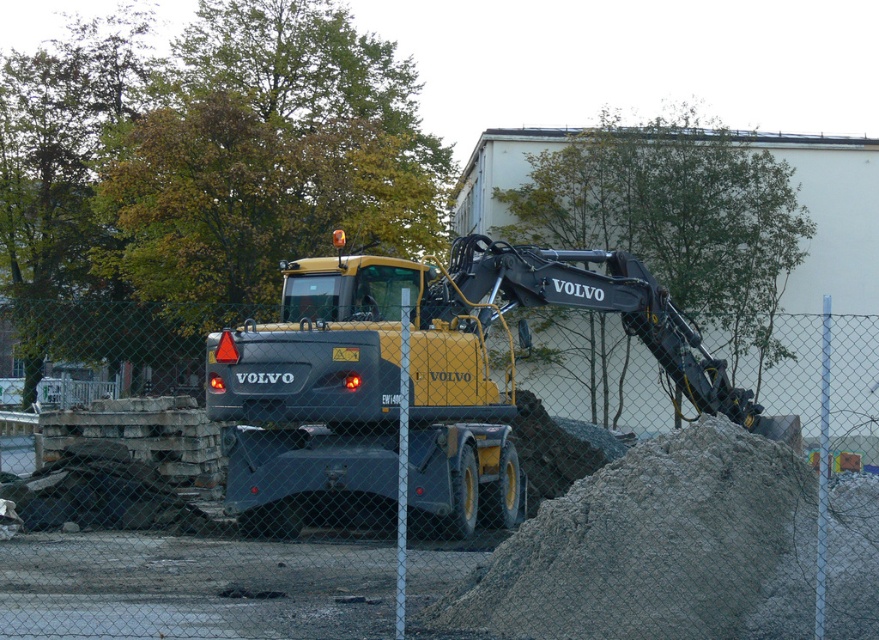
Who is more forward, (218, 504) or (521, 305)?

Point (521, 305) is more forward.

Who is lower down, metal chain-link fence at center or matte yellow volvo excavator at center?

metal chain-link fence at center is lower down.

Describe the element at coordinates (629, 538) in the screenshot. Image resolution: width=879 pixels, height=640 pixels. I see `metal chain-link fence at center` at that location.

This screenshot has height=640, width=879. What are the coordinates of `metal chain-link fence at center` in the screenshot? It's located at (629, 538).